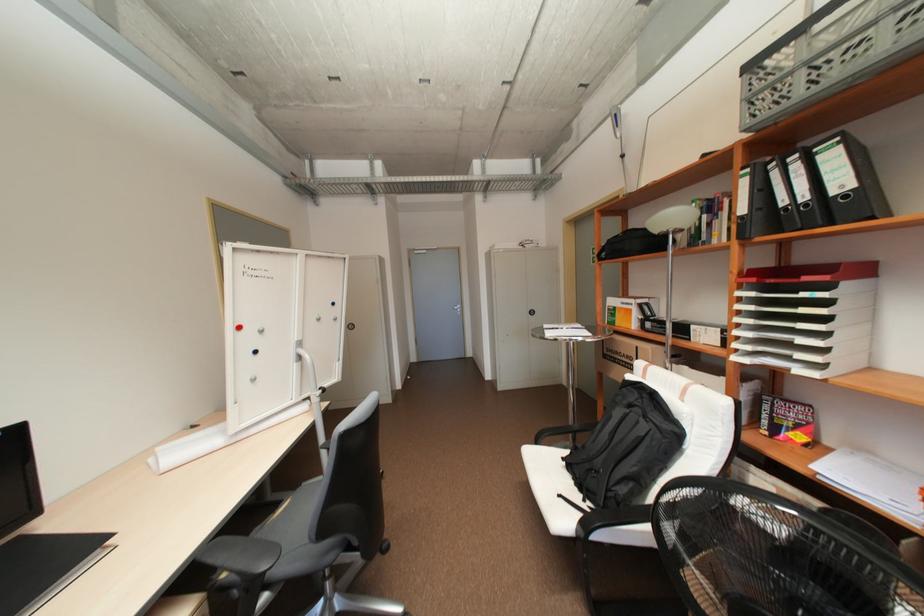
Where would you sit the chair sitting surface? Please return your answer as a coordinate pair (x, y).

(292, 514)